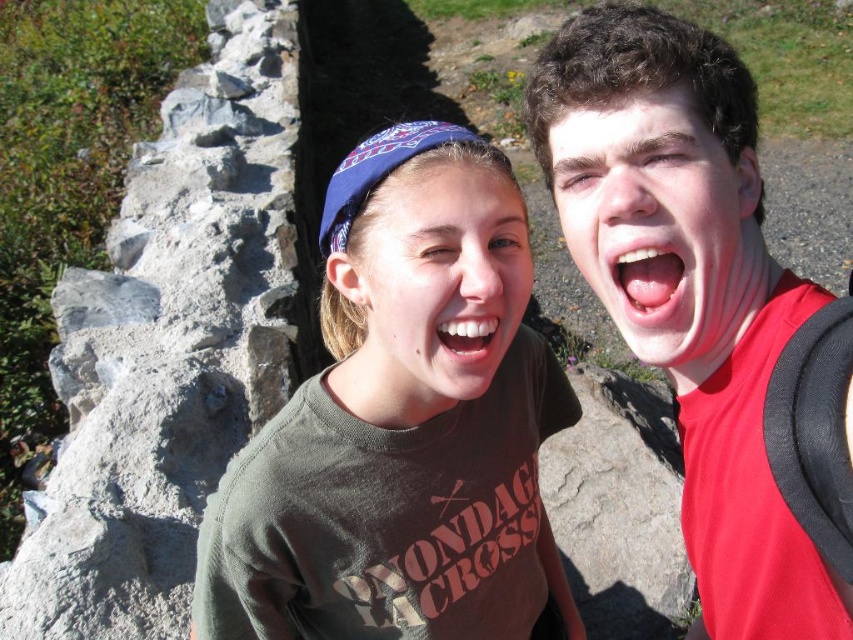
Does green matte t-shirt at center appear on the right side of matte skin face at center?

In fact, green matte t-shirt at center is to the left of matte skin face at center.

Who is positioned more to the right, green matte t-shirt at center or matte skin face at center?

matte skin face at center is more to the right.

Is point (422, 484) closer to viewer compared to point (569, 253)?

Yes, it is in front of point (569, 253).

The height and width of the screenshot is (640, 853). In order to click on green matte t-shirt at center in this screenshot , I will do `click(401, 426)`.

Consider the image. Between gray rough stone at left and red matte shirt at right, which one is positioned higher?

red matte shirt at right is higher up.

Based on the photo, who is positioned more to the left, gray rough stone at left or red matte shirt at right?

From the viewer's perspective, gray rough stone at left appears more on the left side.

Is point (128, 420) more distant than point (556, 104)?

Yes, point (128, 420) is farther from viewer.

You are a GUI agent. You are given a task and a screenshot of the screen. Output one action in this format:
    pyautogui.click(x=<x>, y=<y>)
    Task: Click on the gray rough stone at left
    Image resolution: width=853 pixels, height=640 pixels.
    Given the screenshot: What is the action you would take?
    pyautogui.click(x=169, y=346)

Is green matte t-shirt at center further to the viewer compared to pink glossy lips at center?

Yes, it is behind pink glossy lips at center.

Between point (463, 541) and point (653, 280), which one is positioned in front?

Positioned in front is point (653, 280).

Identify the location of green matte t-shirt at center. The height and width of the screenshot is (640, 853). (401, 426).

At what (x,y) coordinates should I click in order to perform the action: click on green matte t-shirt at center. Please return your answer as a coordinate pair (x, y). This screenshot has width=853, height=640. Looking at the image, I should click on (401, 426).